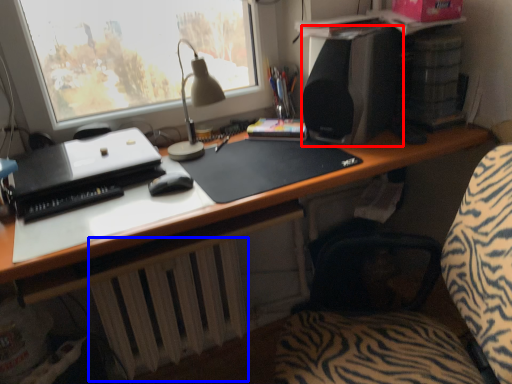
Question: Which point is closer to the camera, loudspeaker (highlighted by a red box) or radiator (highlighted by a blue box)?

Choices:
 (A) loudspeaker
 (B) radiator

Answer: (A)